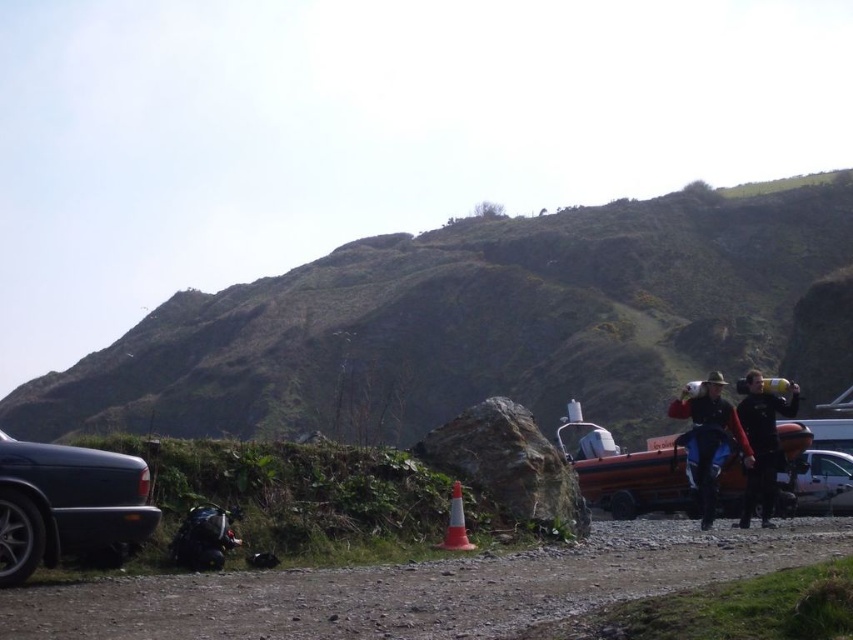
What do you see at coordinates (762, 442) in the screenshot? I see `black rubber boots at right` at bounding box center [762, 442].

Between black rubber boots at right and metallic silver car at lower right, which one is positioned lower?

metallic silver car at lower right is below.

Describe the element at coordinates (762, 442) in the screenshot. I see `black rubber boots at right` at that location.

Locate an element on the screen. This screenshot has height=640, width=853. black rubber boots at right is located at coordinates (762, 442).

At what (x,y) coordinates should I click in order to perform the action: click on green grassy hillside at upper center. Please return your answer as a coordinate pair (x, y). This screenshot has width=853, height=640. Looking at the image, I should click on (467, 323).

Consider the image. Who is more forward, (x=148, y=417) or (x=4, y=545)?

Point (x=4, y=545) is in front.

You are a GUI agent. You are given a task and a screenshot of the screen. Output one action in this format:
    pyautogui.click(x=<x>, y=<y>)
    Task: Click on the green grassy hillside at upper center
    This screenshot has width=853, height=640.
    Given the screenshot: What is the action you would take?
    pyautogui.click(x=467, y=323)

Describe the element at coordinates (67, 504) in the screenshot. I see `shiny metallic car at lower left` at that location.

Can you confirm if shiny metallic car at lower left is thinner than metallic silver car at lower right?

Correct, shiny metallic car at lower left's width is less than metallic silver car at lower right's.

From the picture: Who is more forward, (0, 493) or (830, 496)?

Point (0, 493) is more forward.

Identify the location of shiny metallic car at lower left. This screenshot has width=853, height=640. (67, 504).